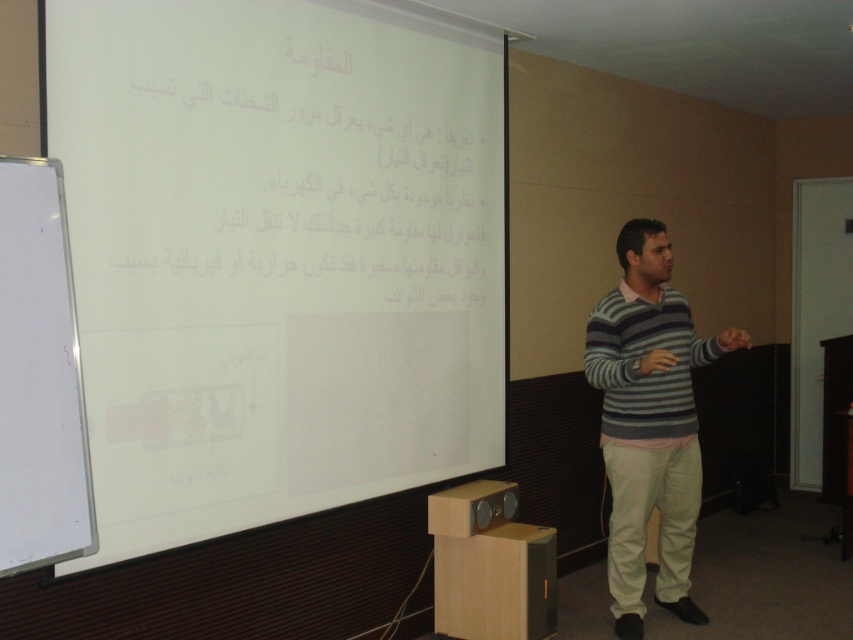
You are standing in the classroom facing the projection screen. There are two points marked on the whiteboard to your left. One is at coordinate point (643, 285) and the other is at point (57, 330). Which point is closer to you?

Point (57, 330) is closer to you since it is in front of point (643, 285).

You are a student sitting in the classroom. You notice the striped sweater at center and the whiteboard at left. Which object is taller?

The striped sweater at center is much taller than the whiteboard at left.

You are a student in the classroom. You notice a point at coordinates [648,422]. Where is this point located on the man?

The point at coordinates [648,422] is located on the striped sweater at center.